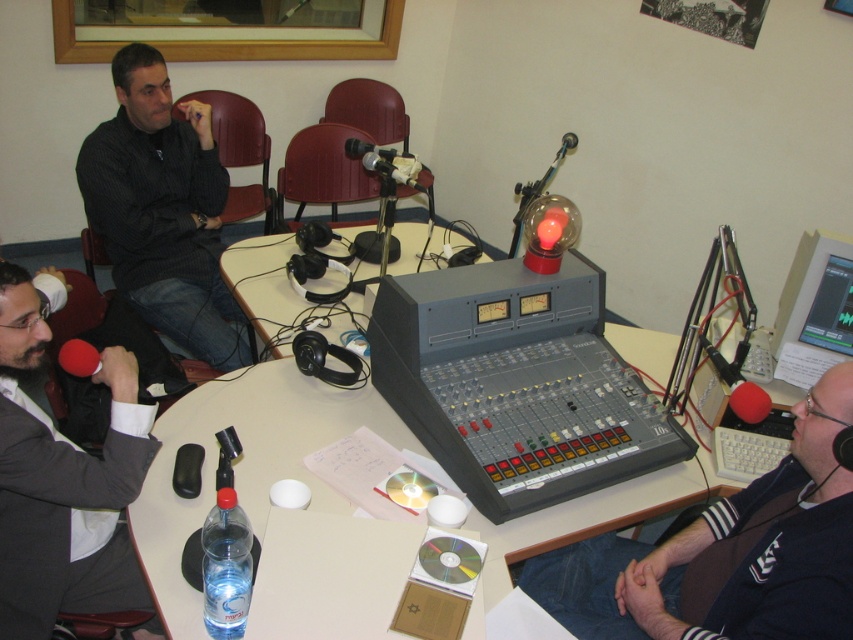
You are standing in the radio studio and want to place a small object on the table. There are two points marked on the table at coordinates point (692, 484) and point (109, 244). Which point is closer to you?

Point (692, 484) is closer to the viewer than point (109, 244).

You are a technician in the radio studio. You need to adjust the microphone stand so that the black matte microphone at lower right is exactly 1 meter away from the gray suit jacket at left. Is the current distance sufficient? Please explain.

The current distance between the black matte microphone at lower right and the gray suit jacket at left is 92.24 centimeters. Since 1 meter equals 100 centimeters, the microphone is currently 7.76 centimeters too close. To meet the requirement, you need to move the microphone stand further away by approximately 7.76 centimeters.

What is the location of the point with coordinates (245, 465) in the radio studio scene?

The point with coordinates (245, 465) is located on the white plastic table at center.